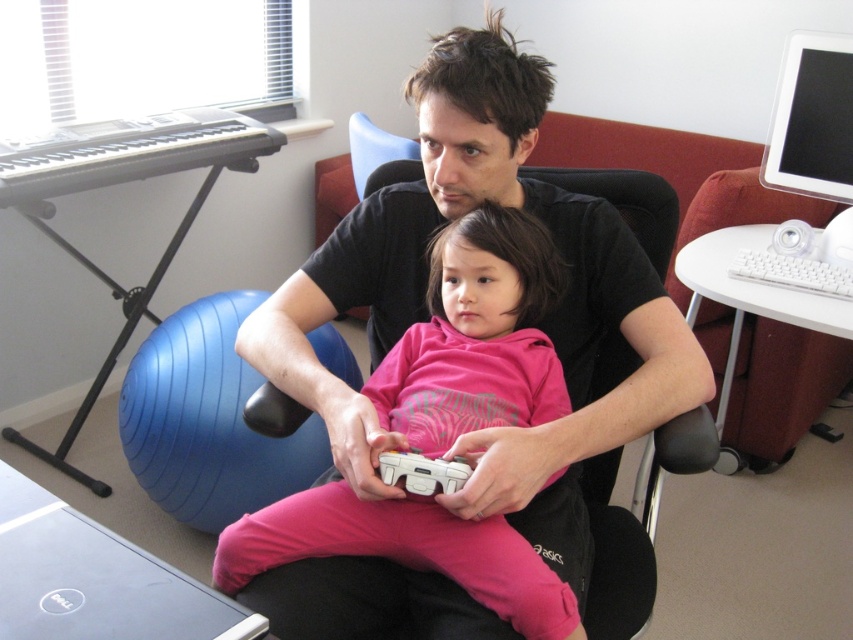
How far apart are pink matte/polyester shirt at center and white matte game controller at center?

pink matte/polyester shirt at center is 17.43 centimeters from white matte game controller at center.

Can you confirm if pink matte/polyester shirt at center is taller than white matte game controller at center?

Correct, pink matte/polyester shirt at center is much taller as white matte game controller at center.

Which is in front, point (577, 627) or point (402, 468)?

Point (577, 627)

In order to click on pink matte/polyester shirt at center in this screenshot , I will do `click(474, 337)`.